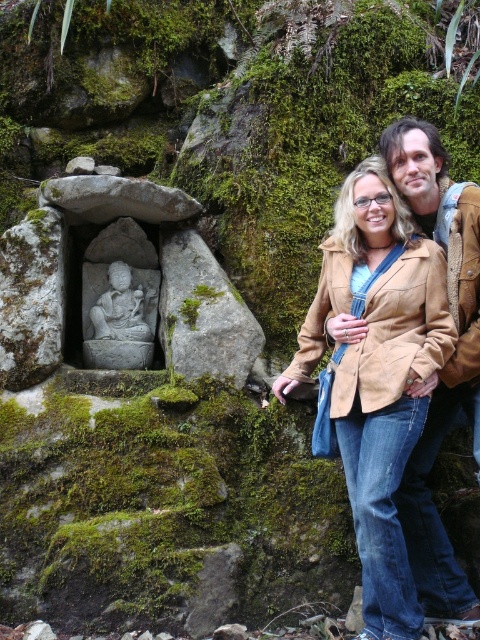
How far apart are brown leather jacket at right and white stone statue at left?

The distance of brown leather jacket at right from white stone statue at left is 4.22 meters.

Who is taller, brown leather jacket at right or white stone statue at left?

Standing taller between the two is white stone statue at left.

Which is in front, point (470, 212) or point (104, 348)?

Point (470, 212)

Where is `brown leather jacket at right`? This screenshot has width=480, height=640. brown leather jacket at right is located at coordinates (450, 356).

Who is positioned more to the left, matte brown leather jacket at center or brown leather jacket at right?

Positioned to the left is matte brown leather jacket at center.

Is matte brown leather jacket at center closer to the viewer compared to brown leather jacket at right?

Yes, matte brown leather jacket at center is closer to the viewer.

Is point (429, 344) farther from camera compared to point (392, 134)?

No, it is not.

Locate an element on the screen. matte brown leather jacket at center is located at coordinates (376, 376).

Does matte brown leather jacket at center have a greater width compared to white stone statue at left?

Yes.

Locate an element on the screen. matte brown leather jacket at center is located at coordinates (376, 376).

Between point (404, 600) and point (99, 348), which one is positioned behind?

Point (99, 348)

Find the location of a particular element. matte brown leather jacket at center is located at coordinates (376, 376).